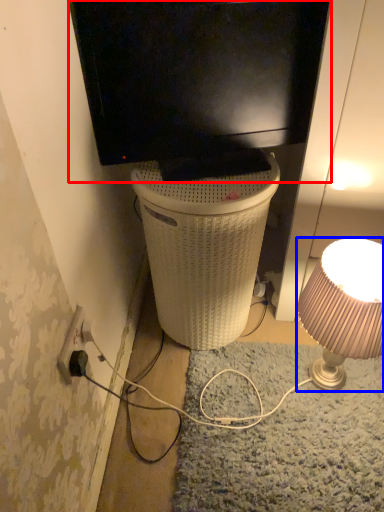
Question: Which of the following is the farthest to the observer, television (highlighted by a red box) or lamp (highlighted by a blue box)?

Choices:
 (A) television
 (B) lamp

Answer: (B)